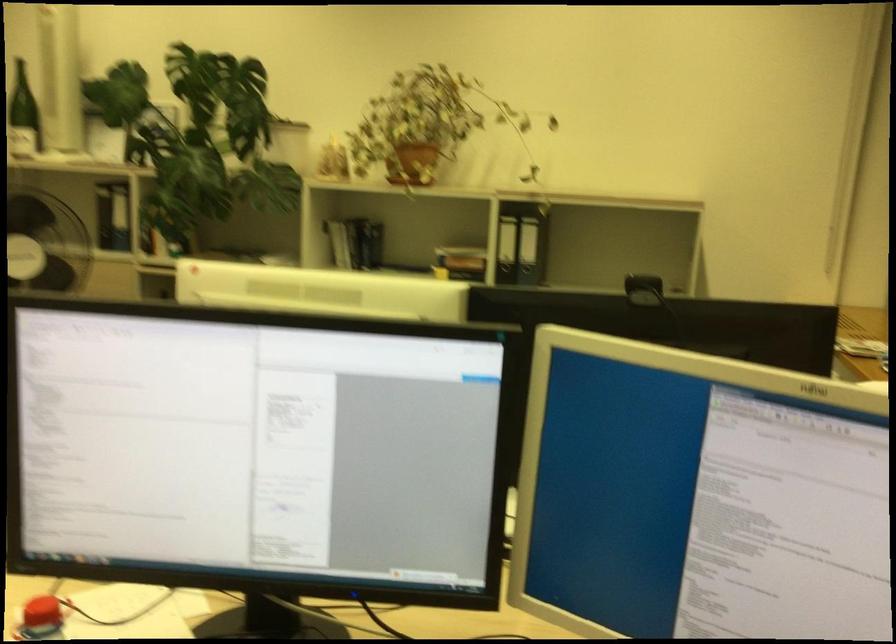
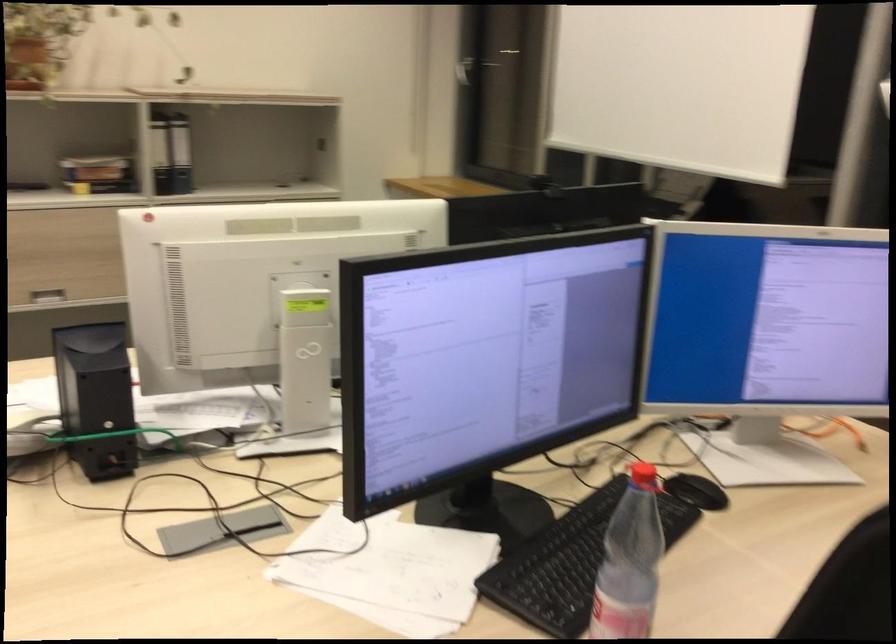
Find the pixel in the second image that matches [497,249] in the first image.

(160, 153)